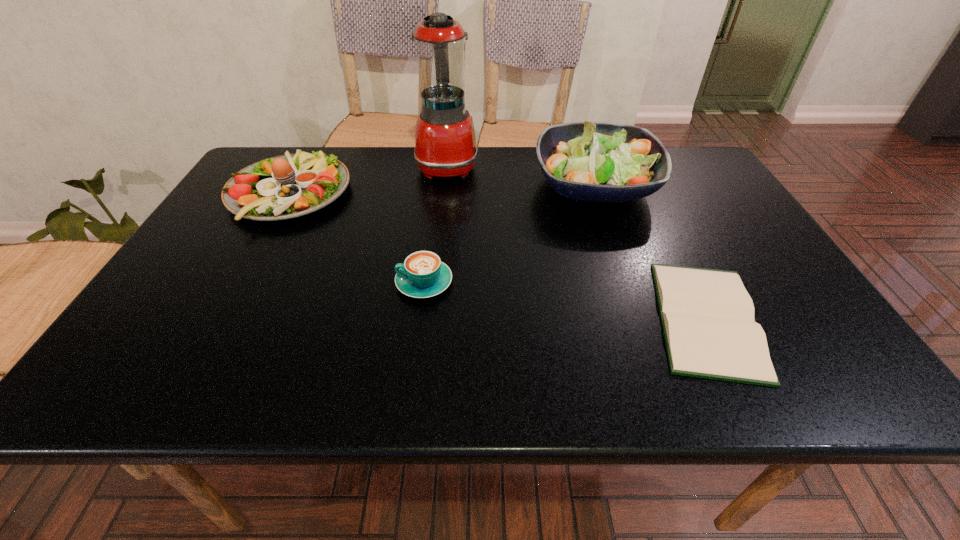
Find the location of a particular element. The width and height of the screenshot is (960, 540). blank area in the image that satisfies the following two spatial constraints: 1. on the controls of the food processor; 2. on the right side of the hardback book is located at coordinates (431, 319).

This screenshot has height=540, width=960. In order to click on free location that satisfies the following two spatial constraints: 1. on the front side of the hardback book; 2. on the left side of the taller salad plate in this screenshot , I will do `click(641, 319)`.